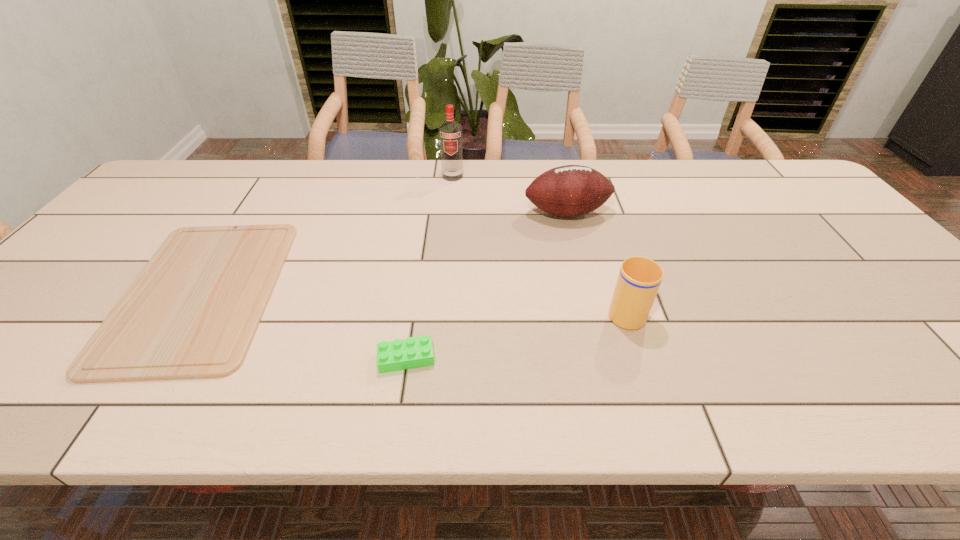
You are a GUI agent. You are given a task and a screenshot of the screen. Output one action in this format:
    pyautogui.click(x=<x>, y=<y>)
    Task: Click on the tallest object
    The image size is (960, 540).
    Given the screenshot: What is the action you would take?
    pyautogui.click(x=450, y=132)

This screenshot has height=540, width=960. What are the coordinates of `vodka` in the screenshot? It's located at (450, 132).

Locate an element on the screen. This screenshot has width=960, height=540. football (American) is located at coordinates (572, 190).

Locate an element on the screen. This screenshot has width=960, height=540. cup is located at coordinates (639, 279).

Locate an element on the screen. The image size is (960, 540). Lego is located at coordinates point(409,353).

Locate an element on the screen. the shortest object is located at coordinates (192, 312).

Find the location of a particular element. The width and height of the screenshot is (960, 540). the leftmost object is located at coordinates (192, 312).

Identify the location of free space located 0.100m on the front label of the tallest object. (450, 199).

The image size is (960, 540). I want to click on free region located on the right of the football (American), so pyautogui.click(x=684, y=212).

This screenshot has height=540, width=960. In order to click on free spot located 0.270m on the side of the cup with the handle in this screenshot , I will do `click(597, 225)`.